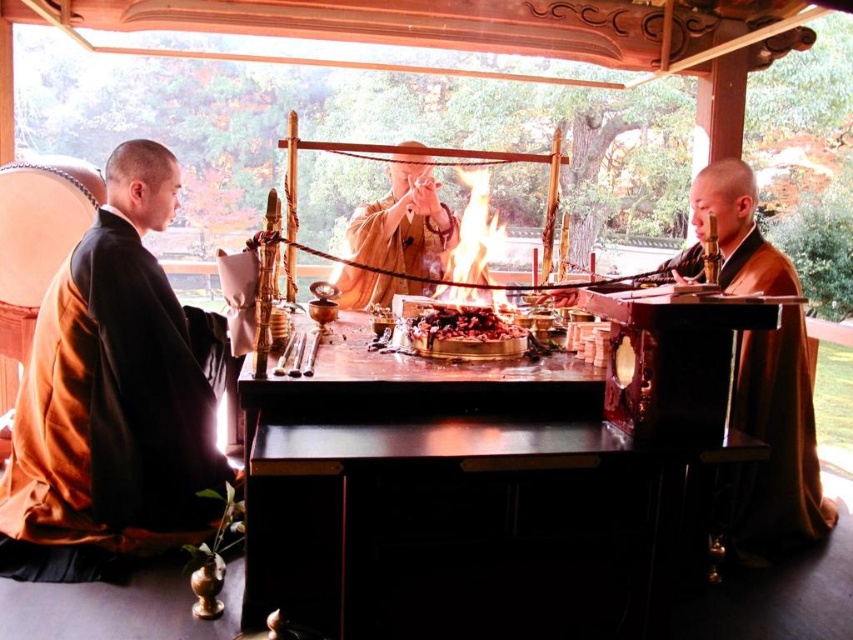
Which is more to the left, matte gold robe at center or charcoal ash at center?

Positioned to the left is matte gold robe at center.

Which is above, matte gold robe at center or charcoal ash at center?

matte gold robe at center is higher up.

The image size is (853, 640). Identify the location of matte gold robe at center. (403, 232).

Locate an element on the screen. matte gold robe at center is located at coordinates (403, 232).

Is orange silk robe at left behind charcoal ash at center?

No.

Is point (80, 458) closer to camera compared to point (436, 332)?

Yes, it is in front of point (436, 332).

Identify the location of orange silk robe at left. This screenshot has height=640, width=853. (111, 417).

Find the location of a particular element. The width and height of the screenshot is (853, 640). orange silk robe at left is located at coordinates (111, 417).

Who is shorter, shiny dark wood table at center or matte gold robe at center?

matte gold robe at center

Between point (631, 515) and point (425, 195), which one is positioned in front?

Point (631, 515) is in front.

At what (x,y) coordinates should I click in order to perform the action: click on shiny dark wood table at center. Please return your answer as a coordinate pair (x, y). The image size is (853, 640). Looking at the image, I should click on (479, 492).